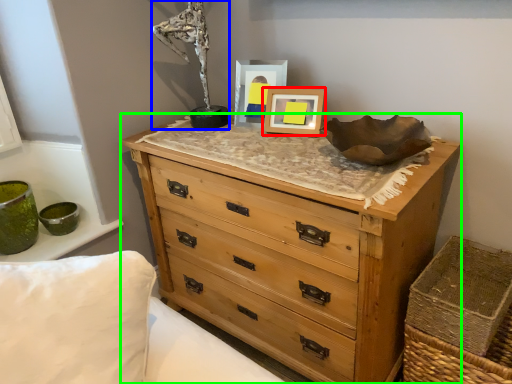
Question: Considering the real-world distances, which object is closest to picture frame (highlighted by a red box)? antique (highlighted by a blue box) or chest of drawers (highlighted by a green box).

Choices:
 (A) antique
 (B) chest of drawers

Answer: (A)